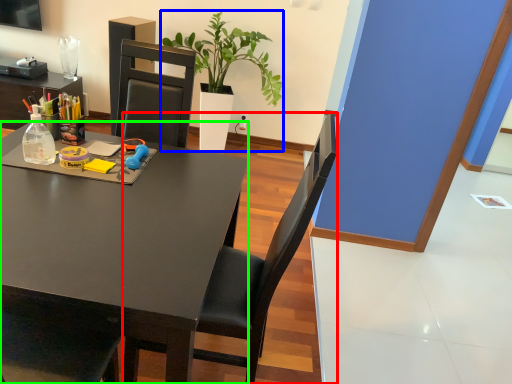
Question: Which object is the closest to the chair (highlighted by a red box)? Choose among these: houseplant (highlighted by a blue box) or desk (highlighted by a green box).

Choices:
 (A) houseplant
 (B) desk

Answer: (B)